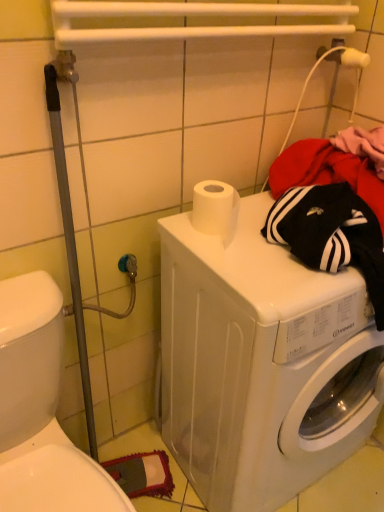
Measure the distance between point (242, 289) and camera.

Point (242, 289) is 31.06 inches from camera.

What do you see at coordinates (261, 362) in the screenshot?
I see `white glossy washing machine at center` at bounding box center [261, 362].

Based on the photo, measure the distance between white glossy washing machine at center and camera.

The distance of white glossy washing machine at center from camera is 29.56 inches.

What is the approximate height of white glossy washing machine at center?

33.06 inches.

Where is `white glossy washing machine at center`? white glossy washing machine at center is located at coordinates point(261,362).

Where is `white plastic washer at lower right`? The width and height of the screenshot is (384, 512). white plastic washer at lower right is located at coordinates (41, 409).

What do you see at coordinates (41, 409) in the screenshot? This screenshot has width=384, height=512. I see `white plastic washer at lower right` at bounding box center [41, 409].

Measure the distance between point (55, 337) and camera.

Point (55, 337) is 36.22 inches away from camera.

Locate an element on the screen. white glossy washing machine at center is located at coordinates (261, 362).

Considering the relative positions of white glossy washing machine at center and white plastic washer at lower right in the image provided, is white glossy washing machine at center to the left of white plastic washer at lower right from the viewer's perspective?

No, white glossy washing machine at center is not to the left of white plastic washer at lower right.

Is the position of white glossy washing machine at center more distant than that of white plastic washer at lower right?

Yes, white glossy washing machine at center is further from the camera.

Is point (255, 433) less distant than point (3, 481)?

That is False.

From the image's perspective, is white glossy washing machine at center located above or below white plastic washer at lower right?

white glossy washing machine at center is above white plastic washer at lower right.

From a real-world perspective, relative to white plastic washer at lower right, is white glossy washing machine at center vertically above or below?

From a real-world perspective, white glossy washing machine at center is physically above white plastic washer at lower right.

Can you confirm if white glossy washing machine at center is thinner than white plastic washer at lower right?

Yes, white glossy washing machine at center is thinner than white plastic washer at lower right.

Which of these two, white glossy washing machine at center or white plastic washer at lower right, stands shorter?

white plastic washer at lower right is shorter.

Between white glossy washing machine at center and white plastic washer at lower right, which one has smaller size?

white plastic washer at lower right.

Is white glossy washing machine at center inside the boundaries of white plastic washer at lower right, or outside?

white glossy washing machine at center exists outside the volume of white plastic washer at lower right.

Looking at this image, are white glossy washing machine at center and white plastic washer at lower right making contact?

white glossy washing machine at center is not next to white plastic washer at lower right, and they're not touching.

Is white glossy washing machine at center facing away from white plastic washer at lower right?

No, white glossy washing machine at center is not facing the opposite direction of white plastic washer at lower right.

Locate an element on the screen. washer lying on the left of white glossy washing machine at center is located at coordinates (x=41, y=409).

Is white plastic washer at lower right to the left of white glossy washing machine at center from the viewer's perspective?

Yes, white plastic washer at lower right is to the left of white glossy washing machine at center.

Based on the photo, is white plastic washer at lower right in front of or behind white glossy washing machine at center in the image?

Clearly, white plastic washer at lower right is in front of white glossy washing machine at center.

Is point (50, 346) less distant than point (252, 500)?

Yes, it is in front of point (252, 500).

From the image's perspective, is white plastic washer at lower right located above or below white glossy washing machine at center?

Clearly, from the image's perspective, white plastic washer at lower right is below white glossy washing machine at center.

From a real-world perspective, is white plastic washer at lower right physically located above or below white glossy washing machine at center?

Clearly, from a real-world perspective, white plastic washer at lower right is below white glossy washing machine at center.

Based on the photo, which object is thinner, white plastic washer at lower right or white glossy washing machine at center?

Thinner between the two is white glossy washing machine at center.

Is white plastic washer at lower right shorter than white glossy washing machine at center?

Correct, white plastic washer at lower right is not as tall as white glossy washing machine at center.

Considering the relative sizes of white plastic washer at lower right and white glossy washing machine at center in the image provided, is white plastic washer at lower right bigger than white glossy washing machine at center?

Actually, white plastic washer at lower right might be smaller than white glossy washing machine at center.

Which is correct: white plastic washer at lower right is inside white glossy washing machine at center, or outside of it?

white plastic washer at lower right cannot be found inside white glossy washing machine at center.

Is white plastic washer at lower right not near white glossy washing machine at center?

They are positioned close to each other.

Is white plastic washer at lower right aimed at white glossy washing machine at center?

No, white plastic washer at lower right is not facing towards white glossy washing machine at center.

This screenshot has width=384, height=512. Identify the location of washer below the white glossy washing machine at center (from the image's perspective). (41, 409).

You are a GUI agent. You are given a task and a screenshot of the screen. Output one action in this format:
    pyautogui.click(x=<x>, y=<y>)
    Task: Click on the washing machine behind the white plastic washer at lower right
    
    Given the screenshot: What is the action you would take?
    pyautogui.click(x=261, y=362)

Where is `washing machine above the white plastic washer at lower right (from a real-world perspective)`? washing machine above the white plastic washer at lower right (from a real-world perspective) is located at coordinates (261, 362).